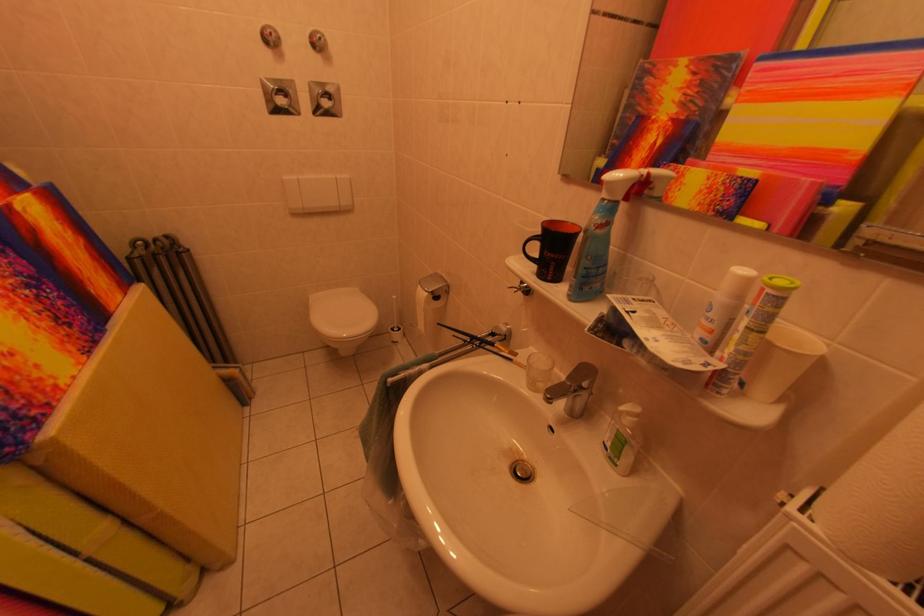
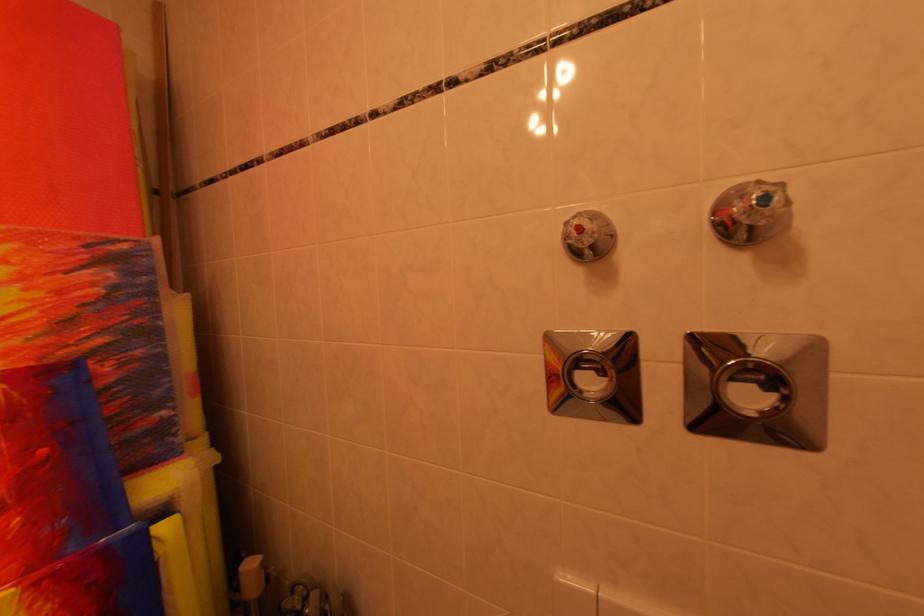
In the second image, find the point that corresponds to (278,39) in the first image.

(589, 232)